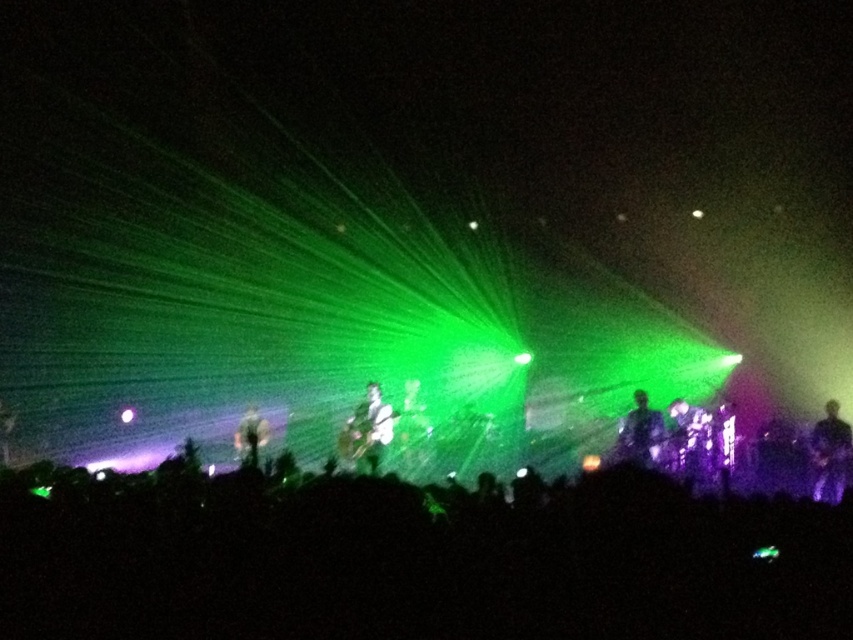
Who is more forward, (815, 496) or (247, 461)?

Point (247, 461) is in front.

Can you confirm if black glossy guitar at right is positioned to the left of matte white guitar at center?

In fact, black glossy guitar at right is to the right of matte white guitar at center.

What do you see at coordinates (830, 452) in the screenshot?
I see `black glossy guitar at right` at bounding box center [830, 452].

I want to click on black glossy guitar at right, so click(x=830, y=452).

Who is shorter, black glossy guitar at right or shiny black guitar at center?

With less height is shiny black guitar at center.

Who is more forward, (828, 406) or (625, 449)?

Point (828, 406) is more forward.

The image size is (853, 640). In order to click on black glossy guitar at right in this screenshot , I will do `click(830, 452)`.

Who is lower down, metallic silver guitar at center or matte white guitar at center?

matte white guitar at center

Does metallic silver guitar at center have a greater height compared to matte white guitar at center?

Correct, metallic silver guitar at center is much taller as matte white guitar at center.

Describe the element at coordinates (370, 428) in the screenshot. This screenshot has width=853, height=640. I see `metallic silver guitar at center` at that location.

Image resolution: width=853 pixels, height=640 pixels. I want to click on metallic silver guitar at center, so click(370, 428).